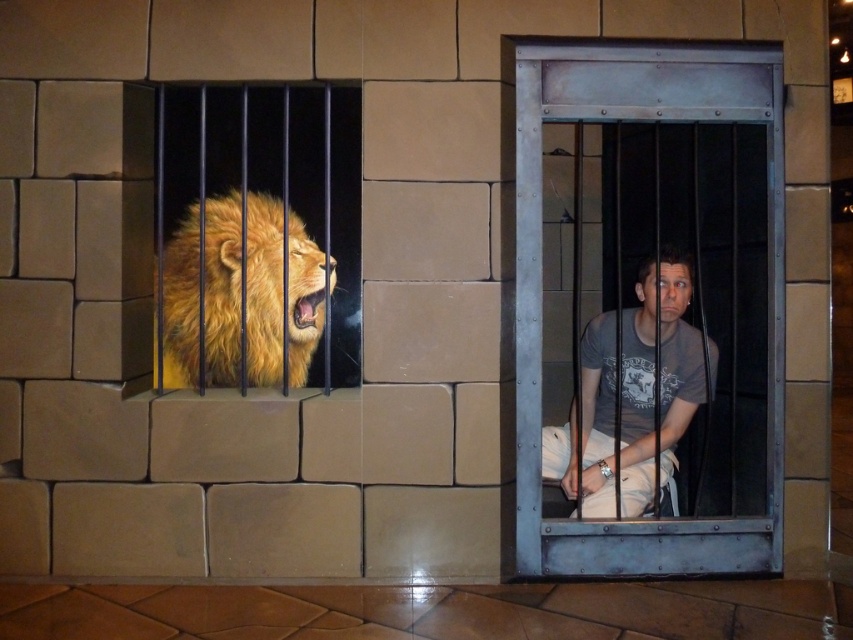
You are a visitor at this themed exhibit and want to take a photo of the golden fur lion at left through the metallic steel bars at center. Is this possible?

The metallic steel bars at center are in front of the golden fur lion at left, so you can take a photo of the golden fur lion at left through the metallic steel bars at center.

You are standing in front of a themed exhibit with a stone wall. On the left is a golden fur lion, and on the right is a metal cage. If you want to take a photo of the golden fur lion at left without including the metal cage in the frame, how far back should you step?

The golden fur lion at left is 10.97 feet away from the viewer. To avoid including the metal cage on the right in the photo, you should step back until the entire golden fur lion at left fits within your camera frame while ensuring the metal cage is out of sight. The exact distance may depend on your camera lens and field of view, but positioning yourself at least 10.97 feet away or slightly further could help achieve this.